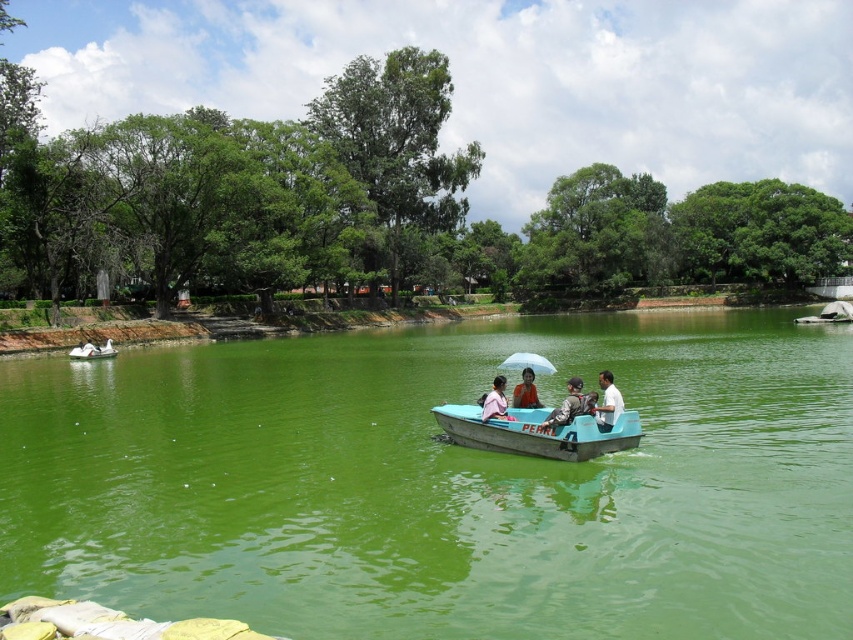
Is teal plastic boat at center taller than orange fabric shirt at center?

Indeed, teal plastic boat at center has a greater height compared to orange fabric shirt at center.

Which is below, teal plastic boat at center or orange fabric shirt at center?

teal plastic boat at center

Between point (467, 436) and point (531, 381), which one is positioned behind?

The point (531, 381) is behind.

Find the location of a particular element. This screenshot has height=640, width=853. teal plastic boat at center is located at coordinates (537, 433).

Does matte gray jacket at center appear on the right side of pink fabric shirt at center?

Indeed, matte gray jacket at center is positioned on the right side of pink fabric shirt at center.

This screenshot has height=640, width=853. Describe the element at coordinates (567, 404) in the screenshot. I see `matte gray jacket at center` at that location.

Locate an element on the screen. matte gray jacket at center is located at coordinates (567, 404).

From the picture: Can you confirm if white cotton shirt at center is shorter than white rubber boat at lower left?

No, white cotton shirt at center is not shorter than white rubber boat at lower left.

Between point (611, 388) and point (108, 340), which one is positioned in front?

Positioned in front is point (611, 388).

You are a GUI agent. You are given a task and a screenshot of the screen. Output one action in this format:
    pyautogui.click(x=<x>, y=<y>)
    Task: Click on the white cotton shirt at center
    The image size is (853, 640).
    Given the screenshot: What is the action you would take?
    pyautogui.click(x=608, y=403)